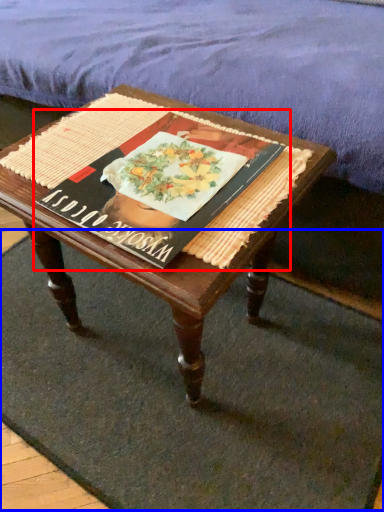
Question: Which of the following is the closest to the observer, paperback book (highlighted by a red box) or doormat (highlighted by a blue box)?

Choices:
 (A) paperback book
 (B) doormat

Answer: (A)